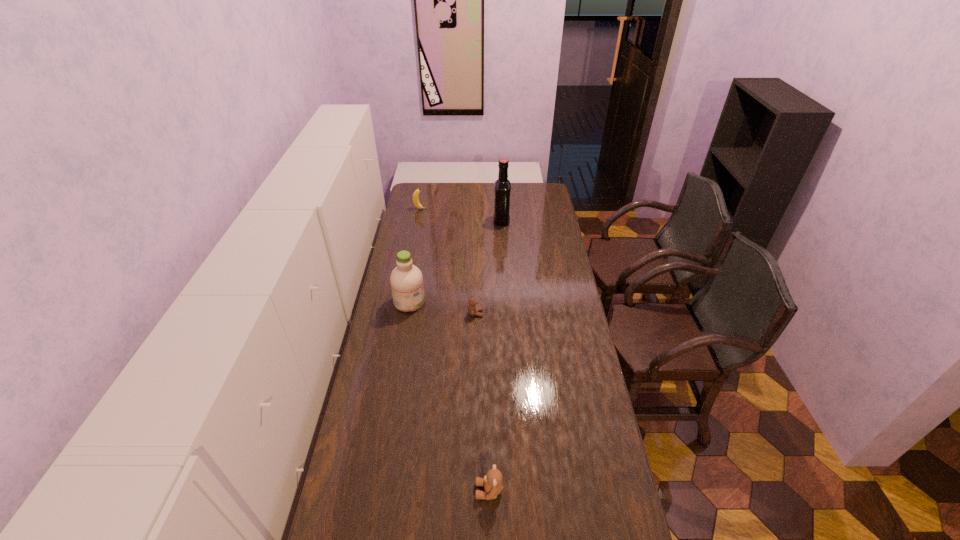
Where is `free region at the right edge of the desktop`? free region at the right edge of the desktop is located at coordinates (533, 206).

The image size is (960, 540). Identify the location of vacant space at the far left corner. (412, 203).

This screenshot has width=960, height=540. I want to click on vacant area that lies between the nearer teddy bear and the shortest object, so click(x=482, y=402).

This screenshot has height=540, width=960. What are the coordinates of `free point between the tallest object and the farthest object` in the screenshot? It's located at (461, 215).

I want to click on free space that is in between the nearest object and the cleansing agent, so click(449, 396).

You are a GUI agent. You are given a task and a screenshot of the screen. Output one action in this format:
    pyautogui.click(x=<x>, y=<y>)
    Task: Click on the empty space that is in between the farther teddy bear and the nearer teddy bear
    
    Given the screenshot: What is the action you would take?
    pyautogui.click(x=482, y=402)

Locate an element on the screen. vacant space that is in between the banana and the rightmost object is located at coordinates (461, 215).

Locate an element on the screen. Image resolution: width=960 pixels, height=540 pixels. empty space that is in between the shorter teddy bear and the farthest object is located at coordinates (448, 261).

Where is `vacant area that lies between the fourth shortest object and the banana`? vacant area that lies between the fourth shortest object and the banana is located at coordinates (415, 255).

The width and height of the screenshot is (960, 540). In order to click on free space between the fourth shortest object and the nearer teddy bear in this screenshot , I will do `click(449, 396)`.